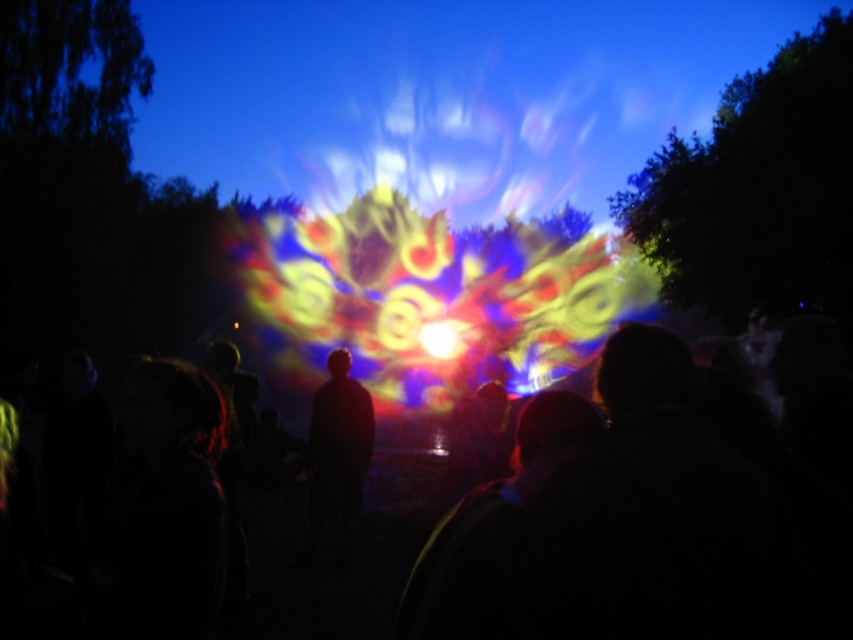
Question: Can you confirm if silhouette figure at center is positioned to the left of bright yellow light at center?

Choices:
 (A) yes
 (B) no

Answer: (A)

Question: Among these objects, which one is nearest to the camera?

Choices:
 (A) black matte crowd at center
 (B) bright yellow light at center
 (C) silhouette figure at center

Answer: (A)

Question: Can you confirm if black matte crowd at center is positioned to the left of bright yellow light at center?

Choices:
 (A) yes
 (B) no

Answer: (A)

Question: Estimate the real-world distances between objects in this image. Which object is closer to the silhouette figure at center?

Choices:
 (A) black matte crowd at center
 (B) bright yellow light at center

Answer: (A)

Question: Does black matte crowd at center have a lesser width compared to silhouette figure at center?

Choices:
 (A) yes
 (B) no

Answer: (B)

Question: Which of these objects is positioned farthest from the bright yellow light at center?

Choices:
 (A) silhouette figure at center
 (B) black matte crowd at center

Answer: (A)